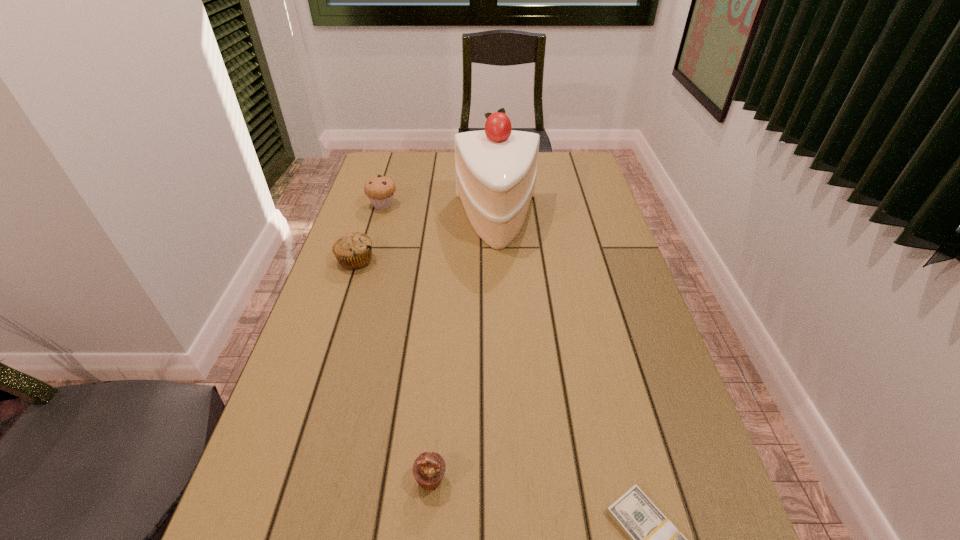
What are the coordinates of `the fourth closest object relative to the tallest object` in the screenshot? It's located at (653, 539).

Identify the location of muffin that is the second closest to the farthest muffin. (429, 468).

Identify which muffin is located as the third nearest to the dollar. Please provide its 2D coordinates. Your answer should be formatted as a tuple, i.e. [(x, y)], where the tuple contains the x and y coordinates of a point satisfying the conditions above.

[(380, 190)]

At what (x,y) coordinates should I click in order to perform the action: click on vacant space that satisfies the following two spatial constraints: 1. on the back side of the second farthest muffin; 2. on the right side of the farthest muffin. Please return your answer as a coordinate pair (x, y). The height and width of the screenshot is (540, 960). Looking at the image, I should click on (373, 205).

Image resolution: width=960 pixels, height=540 pixels. Find the location of `free location that satisfies the following two spatial constraints: 1. on the back side of the cake; 2. on the right side of the rightmost muffin`. free location that satisfies the following two spatial constraints: 1. on the back side of the cake; 2. on the right side of the rightmost muffin is located at coordinates (452, 221).